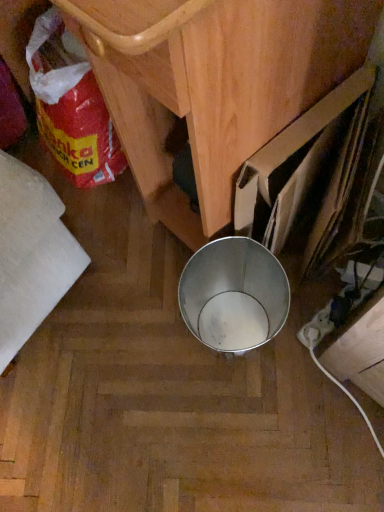
Locate an element on the screen. vacant area that is in front of metallic bucket at center is located at coordinates point(167,382).